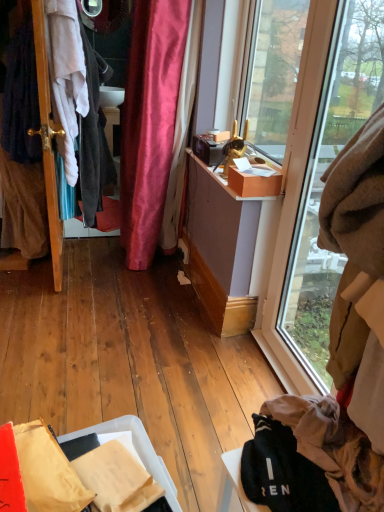
Question: Does clear glass window at right lie behind wooden door at left?

Choices:
 (A) yes
 (B) no

Answer: (B)

Question: Considering the relative sizes of clear glass window at right and wooden door at left in the image provided, is clear glass window at right smaller than wooden door at left?

Choices:
 (A) no
 (B) yes

Answer: (B)

Question: Is clear glass window at right thinner than wooden door at left?

Choices:
 (A) yes
 (B) no

Answer: (A)

Question: Is clear glass window at right far away from wooden door at left?

Choices:
 (A) no
 (B) yes

Answer: (B)

Question: Can you confirm if clear glass window at right is positioned to the right of wooden door at left?

Choices:
 (A) yes
 (B) no

Answer: (A)

Question: Considering the positions of matte cardboard box at upper right and brown fuzzy blanket at upper right, which is the first clothing from right to left, in the image, is matte cardboard box at upper right taller or shorter than brown fuzzy blanket at upper right, which is the first clothing from right to left,?

Choices:
 (A) tall
 (B) short

Answer: (B)

Question: In the image, is matte cardboard box at upper right on the left side or the right side of brown fuzzy blanket at upper right, the second clothing from the top?

Choices:
 (A) left
 (B) right

Answer: (A)

Question: Based on their sizes in the image, would you say matte cardboard box at upper right is bigger or smaller than brown fuzzy blanket at upper right, the second clothing from the top?

Choices:
 (A) small
 (B) big

Answer: (A)

Question: From a real-world perspective, relative to brown fuzzy blanket at upper right, marked as the first clothing in a front-to-back arrangement, is matte cardboard box at upper right vertically above or below?

Choices:
 (A) below
 (B) above

Answer: (A)

Question: Is point (74, 103) positioned closer to the camera than point (347, 380)?

Choices:
 (A) closer
 (B) farther

Answer: (B)

Question: From a real-world perspective, relative to brown fuzzy blanket at upper right, the 2th clothing positioned from the back, is dark gray fabric at left, marked as the first clothing in a back-to-front arrangement, vertically above or below?

Choices:
 (A) below
 (B) above

Answer: (A)

Question: In terms of width, does dark gray fabric at left, which appears as the second clothing when ordered from the bottom, look wider or thinner when compared to brown fuzzy blanket at upper right, the second clothing from the left?

Choices:
 (A) wide
 (B) thin

Answer: (A)

Question: Considering the positions of dark gray fabric at left, which is counted as the 2th clothing, starting from the right, and brown fuzzy blanket at upper right, the 1th clothing when ordered from bottom to top, in the image, is dark gray fabric at left, which is counted as the 2th clothing, starting from the right, taller or shorter than brown fuzzy blanket at upper right, the 1th clothing when ordered from bottom to top,?

Choices:
 (A) tall
 (B) short

Answer: (A)

Question: In terms of size, does dark gray fabric at left, arranged as the 1th clothing when viewed from the top, appear bigger or smaller than wooden door at left?

Choices:
 (A) big
 (B) small

Answer: (B)

Question: Is dark gray fabric at left, which is counted as the 2th clothing, starting from the right, in front of or behind wooden door at left in the image?

Choices:
 (A) behind
 (B) front

Answer: (B)